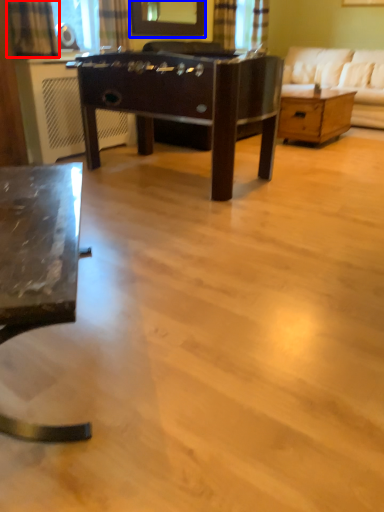
Question: Which point is further to the camera, curtain (highlighted by a red box) or mirror (highlighted by a blue box)?

Choices:
 (A) curtain
 (B) mirror

Answer: (B)